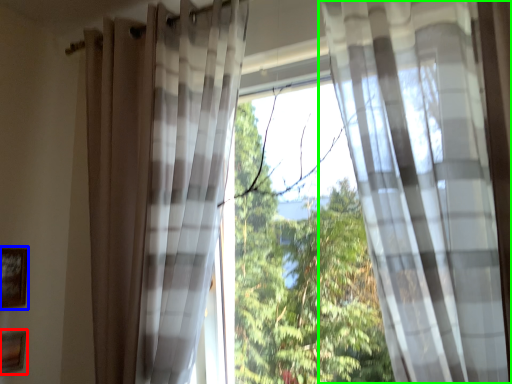
Question: Which is farther away from picture frame (highlighted by a red box)? picture frame (highlighted by a blue box) or curtain (highlighted by a green box)?

Choices:
 (A) picture frame
 (B) curtain

Answer: (B)